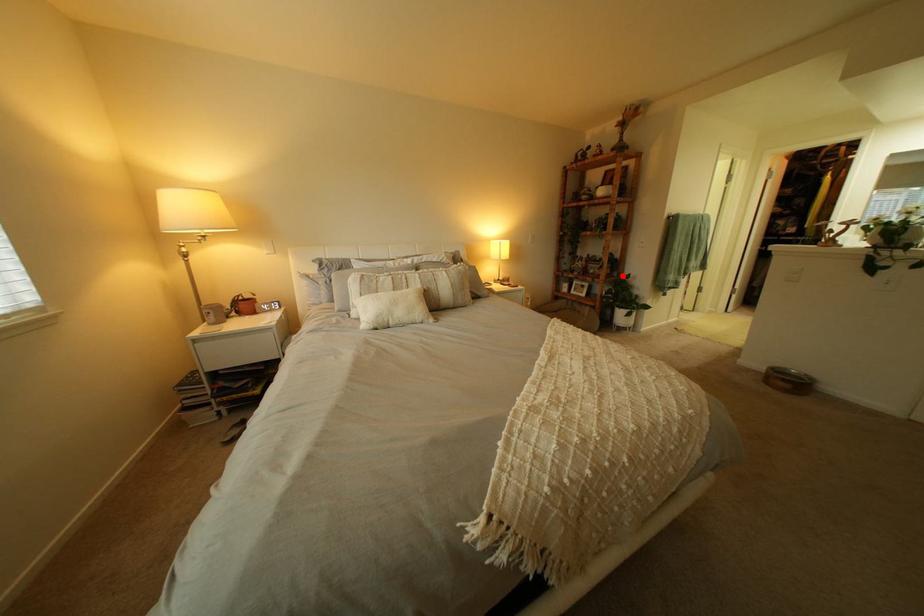
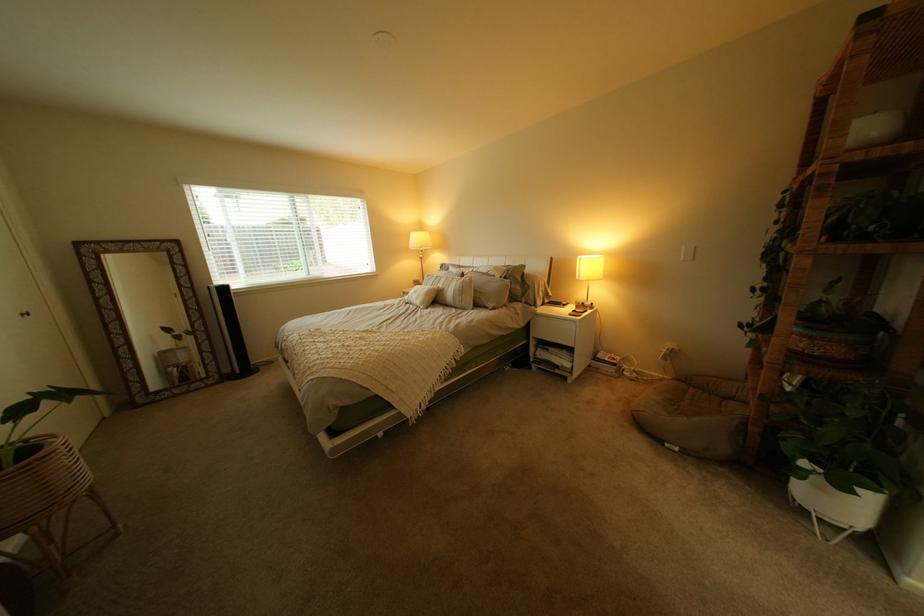
Question: I am providing you with two images of the same scene from different viewpoints. Image1 has a red point marked. In image2, the corresponding 3D location appears at what relative position? Reply with the corresponding letter.

Choices:
 (A) Closer
 (B) Farther

Answer: (B)